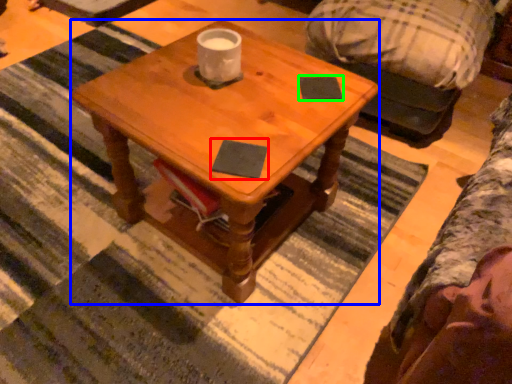
Question: Which is nearer to the notepad (highlighted by a red box)? coffee table (highlighted by a blue box) or notepad (highlighted by a green box).

Choices:
 (A) coffee table
 (B) notepad

Answer: (B)